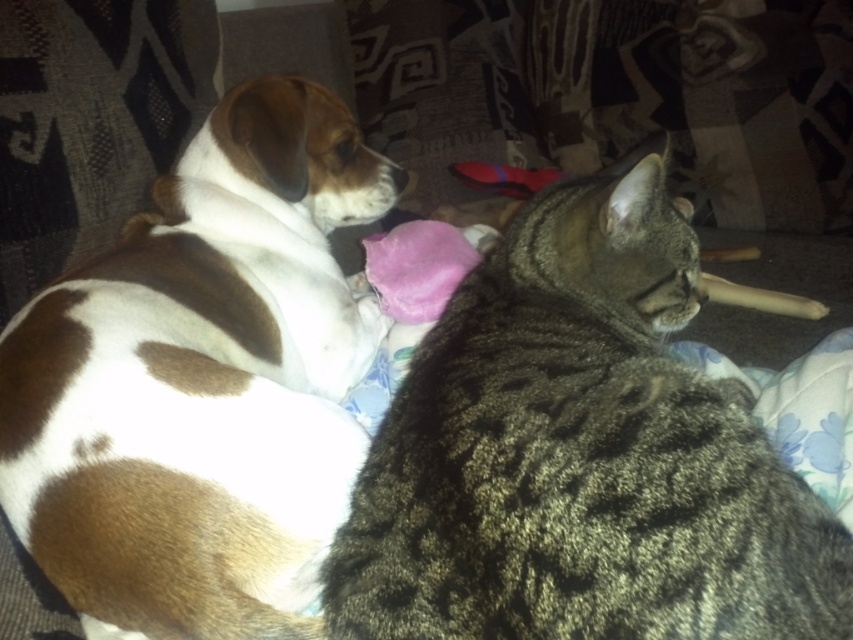
Does point (692, 428) lie behind point (132, 416)?

No, (692, 428) is closer to viewer.

Measure the distance between tabby fur cat at center and camera.

A distance of 25.49 inches exists between tabby fur cat at center and camera.

Locate an element on the screen. This screenshot has height=640, width=853. tabby fur cat at center is located at coordinates (579, 452).